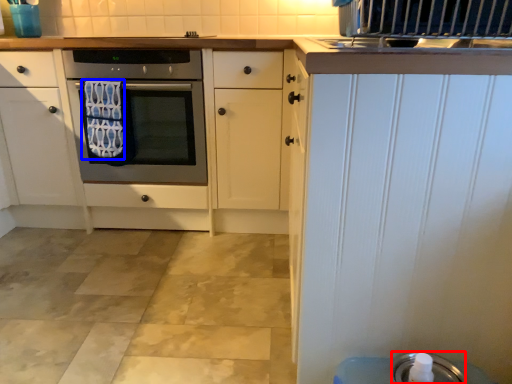
Question: Which object is further to the camera taking this photo, appliance (highlighted by a red box) or bath towel (highlighted by a blue box)?

Choices:
 (A) appliance
 (B) bath towel

Answer: (B)